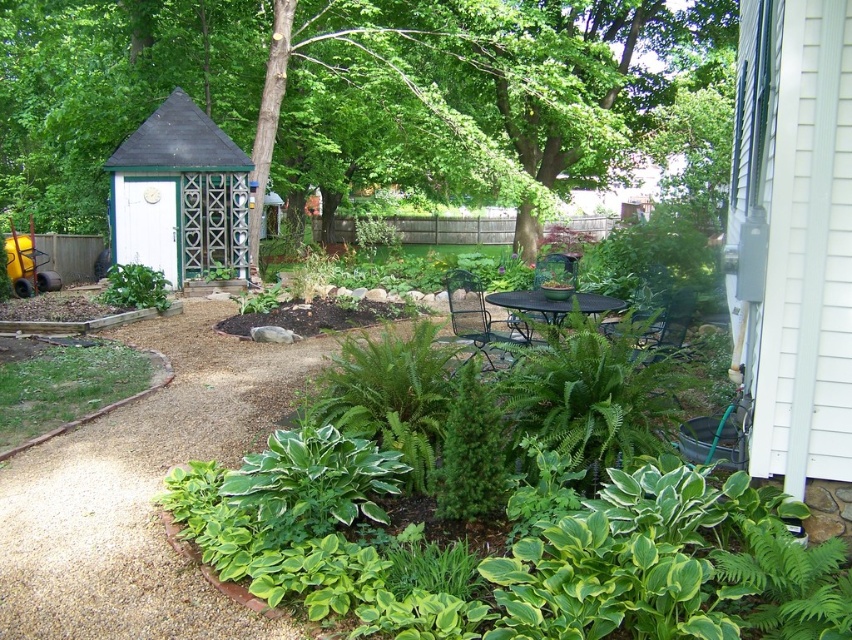
You are planning to install a new bird feeder that requires a height of at least 3 meters to avoid ground predators. Given the green leafy tree at center and the white painted wood gazebo at left, which structure would be suitable for mounting the bird feeder?

The green leafy tree at center is taller than the white painted wood gazebo at left, so the bird feeder should be mounted on the green leafy tree at center to meet the required height of 3 meters.

You are standing in the backyard garden and want to walk from the white painted wood gazebo at left to the green leafy tree at center. Which direction should you head?

You should head to the right because the green leafy tree at center is located to the right of the white painted wood gazebo at left.

You are planning to install a new bench in the backyard garden. The bench requires a space that can accommodate its size. Given the presence of the green leafy tree at center and the white painted wood gazebo at left, which object would you consider to have more space around it for placing the bench?

The green leafy tree at center is larger in size than the white painted wood gazebo at left, so there is likely more space around the white painted wood gazebo at left to place the bench.